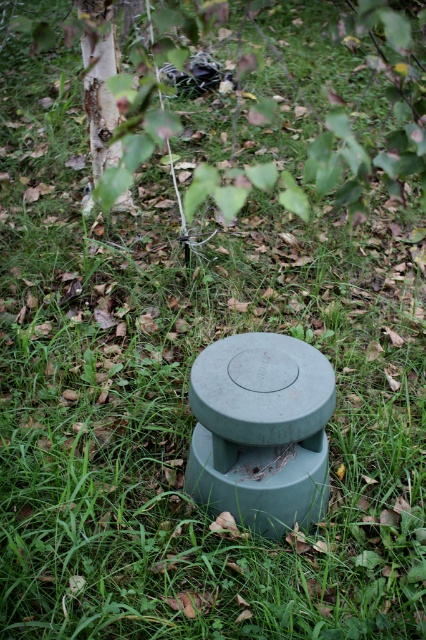
Question: Is green matte cement at center bigger than smooth white bark at upper left?

Choices:
 (A) no
 (B) yes

Answer: (A)

Question: Does green matte cement at center have a larger size compared to smooth white bark at upper left?

Choices:
 (A) no
 (B) yes

Answer: (A)

Question: Which point is farther to the camera?

Choices:
 (A) click(x=247, y=432)
 (B) click(x=106, y=29)

Answer: (B)

Question: Which point is farther to the camera?

Choices:
 (A) smooth white bark at upper left
 (B) green matte cement at center

Answer: (A)

Question: Is green matte cement at center below smooth white bark at upper left?

Choices:
 (A) yes
 (B) no

Answer: (A)